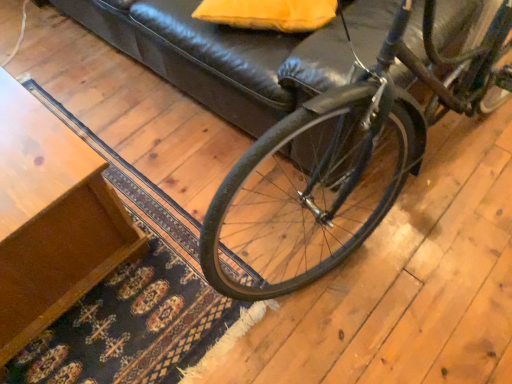
The width and height of the screenshot is (512, 384). Describe the element at coordinates (268, 14) in the screenshot. I see `matte yellow pillow at upper center` at that location.

The height and width of the screenshot is (384, 512). What do you see at coordinates (51, 219) in the screenshot?
I see `wooden table at lower left` at bounding box center [51, 219].

At what (x,y) coordinates should I click in order to perform the action: click on matte yellow pillow at upper center. Please return your answer as a coordinate pair (x, y). The height and width of the screenshot is (384, 512). Looking at the image, I should click on (268, 14).

Consider the image. Does wooden table at lower left have a larger size compared to shiny black bicycle at center?

No, wooden table at lower left is not bigger than shiny black bicycle at center.

Which object is further away from the camera taking this photo, wooden table at lower left or shiny black bicycle at center?

Positioned behind is wooden table at lower left.

Which object is thinner, wooden table at lower left or shiny black bicycle at center?

With smaller width is wooden table at lower left.

Considering the sizes of shiny black bicycle at center and matte yellow pillow at upper center in the image, is shiny black bicycle at center bigger or smaller than matte yellow pillow at upper center?

In the image, shiny black bicycle at center appears to be larger than matte yellow pillow at upper center.

Identify the location of bicycle located on the right of matte yellow pillow at upper center. This screenshot has width=512, height=384. (338, 162).

Is shiny black bicycle at center inside the boundaries of matte yellow pillow at upper center, or outside?

shiny black bicycle at center lies outside matte yellow pillow at upper center.

From the image's perspective, which one is positioned lower, shiny black bicycle at center or matte yellow pillow at upper center?

shiny black bicycle at center, from the image's perspective.

In the scene shown: Is matte yellow pillow at upper center placed right next to wooden table at lower left?

matte yellow pillow at upper center and wooden table at lower left are clearly separated.

Is point (334, 4) less distant than point (102, 219)?

No, (334, 4) is further to viewer.

Is matte yellow pillow at upper center wider than wooden table at lower left?

In fact, matte yellow pillow at upper center might be narrower than wooden table at lower left.

In the scene shown: Is matte yellow pillow at upper center bigger or smaller than wooden table at lower left?

Considering their sizes, matte yellow pillow at upper center takes up less space than wooden table at lower left.

Which is behind, point (232, 19) or point (344, 97)?

Point (232, 19)

In the scene shown: Is matte yellow pillow at upper center aimed at shiny black bicycle at center?

Yes, matte yellow pillow at upper center is facing shiny black bicycle at center.

This screenshot has width=512, height=384. I want to click on bicycle on the right of matte yellow pillow at upper center, so click(x=338, y=162).

Does shiny black bicycle at center have a smaller size compared to wooden table at lower left?

No, shiny black bicycle at center is not smaller than wooden table at lower left.

What's the angular difference between shiny black bicycle at center and wooden table at lower left's facing directions?

They differ by 85.3 degrees in their facing directions.

From the image's perspective, is shiny black bicycle at center located above or below wooden table at lower left?

shiny black bicycle at center is situated higher than wooden table at lower left in the image.

Considering the relative sizes of shiny black bicycle at center and wooden table at lower left in the image provided, is shiny black bicycle at center wider than wooden table at lower left?

Correct, the width of shiny black bicycle at center exceeds that of wooden table at lower left.

Does wooden table at lower left have a lesser height compared to matte yellow pillow at upper center?

In fact, wooden table at lower left may be taller than matte yellow pillow at upper center.

Which is more to the right, wooden table at lower left or matte yellow pillow at upper center?

matte yellow pillow at upper center.

Where is `pillow behind the wooden table at lower left`? The height and width of the screenshot is (384, 512). pillow behind the wooden table at lower left is located at coordinates (268, 14).

The width and height of the screenshot is (512, 384). Identify the location of bicycle in front of the wooden table at lower left. (338, 162).

This screenshot has height=384, width=512. What are the coordinates of `bicycle that appears above the matte yellow pillow at upper center (from a real-world perspective)` in the screenshot? It's located at (x=338, y=162).

Estimate the real-world distances between objects in this image. Which object is closer to matte yellow pillow at upper center, shiny black bicycle at center or wooden table at lower left?

shiny black bicycle at center is closer to matte yellow pillow at upper center.

Which object lies further to the anchor point shiny black bicycle at center, wooden table at lower left or matte yellow pillow at upper center?

Based on the image, wooden table at lower left appears to be further to shiny black bicycle at center.

Based on their spatial positions, is shiny black bicycle at center or matte yellow pillow at upper center closer to wooden table at lower left?

shiny black bicycle at center is closer to wooden table at lower left.

In the scene shown: Looking at the image, which one is located further to matte yellow pillow at upper center, wooden table at lower left or shiny black bicycle at center?

Among the two, wooden table at lower left is located further to matte yellow pillow at upper center.

When comparing their distances from shiny black bicycle at center, does matte yellow pillow at upper center or wooden table at lower left seem closer?

Among the two, matte yellow pillow at upper center is located nearer to shiny black bicycle at center.

From the image, which object appears to be nearer to wooden table at lower left, matte yellow pillow at upper center or shiny black bicycle at center?

shiny black bicycle at center is closer to wooden table at lower left.

Locate an element on the screen. The image size is (512, 384). pillow between wooden table at lower left and shiny black bicycle at center in the horizontal direction is located at coordinates (268, 14).